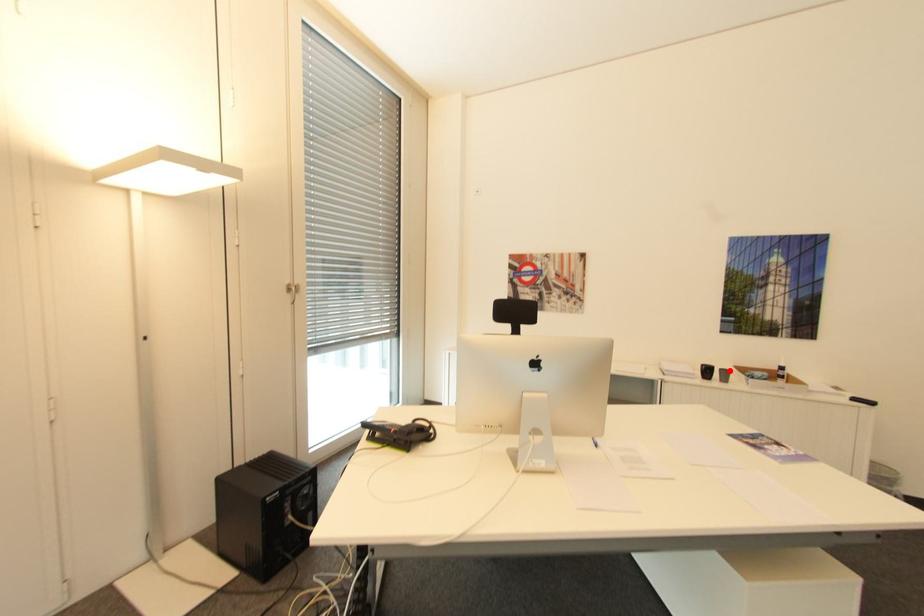
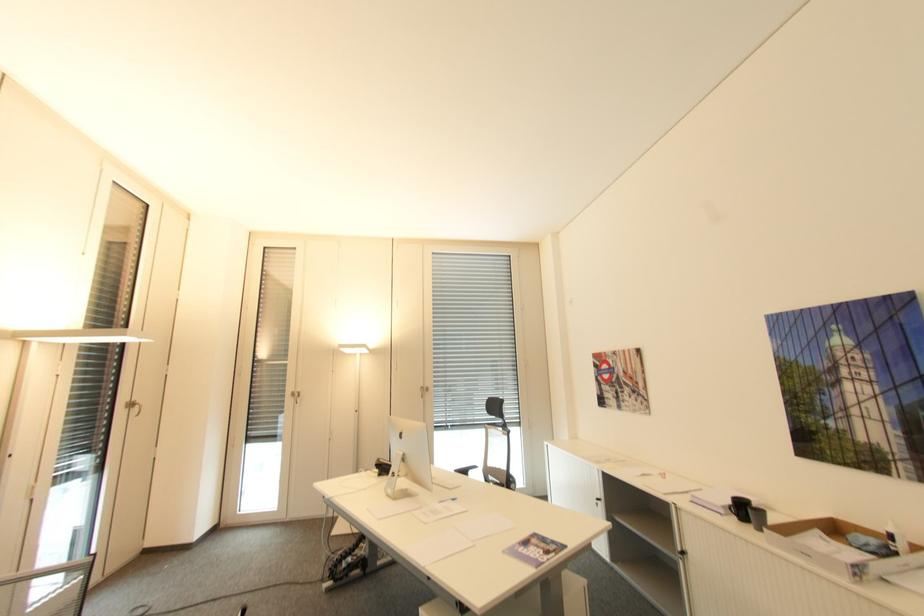
Where in the second image is the point corresponding to the highlighted location from the first image?

(766, 513)